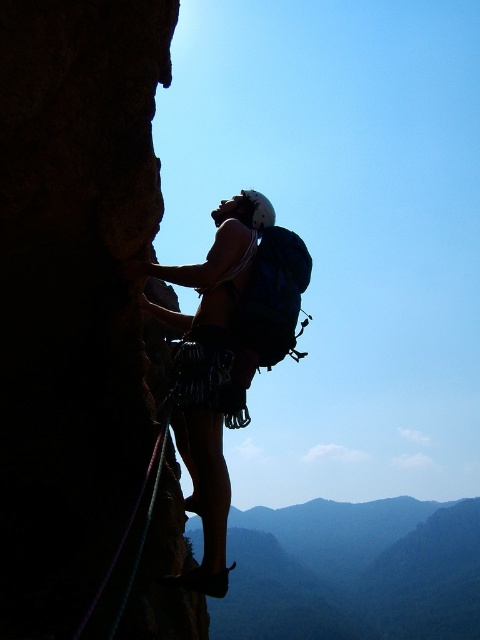
Question: Where is dark green textured mountain at lower center located in relation to purple nylon rope at left in the image?

Choices:
 (A) above
 (B) below

Answer: (B)

Question: Does dark green textured mountain at lower center have a smaller size compared to purple nylon rope at left?

Choices:
 (A) yes
 (B) no

Answer: (B)

Question: Among these points, which one is farthest from the camera?

Choices:
 (A) (108, 566)
 (B) (422, 518)

Answer: (B)

Question: Does dark green textured mountain at lower center have a lesser width compared to purple nylon rope at left?

Choices:
 (A) no
 (B) yes

Answer: (A)

Question: Which object appears closest to the camera in this image?

Choices:
 (A) purple nylon rope at left
 (B) dark green textured mountain at lower center

Answer: (A)